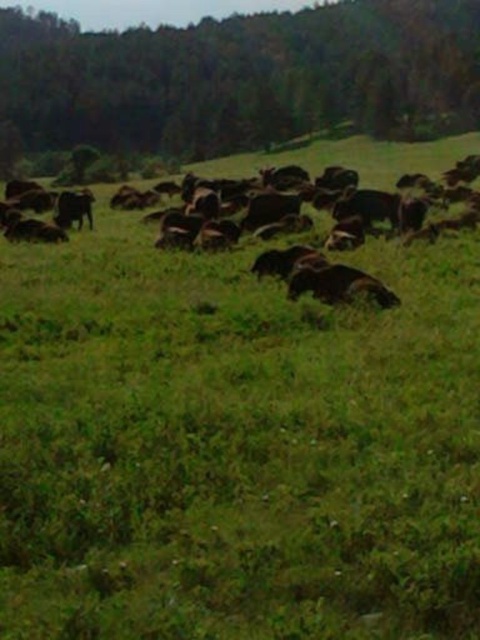
Does green grassy hillside at upper center appear under brown furry cow at center?

No, green grassy hillside at upper center is not below brown furry cow at center.

Between green grassy hillside at upper center and brown furry cow at center, which one appears on the right side from the viewer's perspective?

brown furry cow at center is more to the right.

Between point (158, 112) and point (11, 262), which one is positioned behind?

Point (158, 112)

At what (x,y) coordinates should I click in order to perform the action: click on green grassy hillside at upper center. Please return your answer as a coordinate pair (x, y). The image size is (480, 640). Looking at the image, I should click on (242, 77).